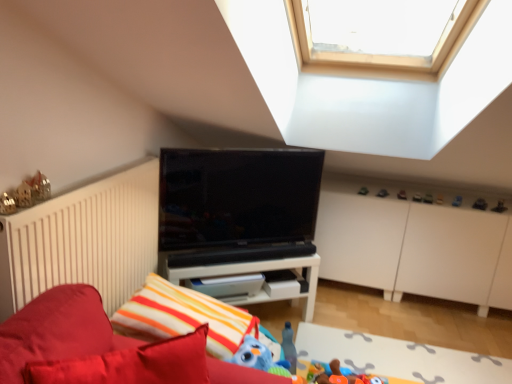
What do you see at coordinates (32, 191) in the screenshot? Image resolution: width=512 pixels, height=384 pixels. I see `wooden house at left, which is counted as the first toy, starting from the left` at bounding box center [32, 191].

Identify the location of green matte toy at upper right, the 1th toy from the back. (362, 191).

What do you see at coordinates (397, 357) in the screenshot? The image size is (512, 384). I see `white soft rug at lower center` at bounding box center [397, 357].

Measure the distance between white soft rug at lower center and camera.

They are 2.18 meters apart.

The width and height of the screenshot is (512, 384). What do you see at coordinates (237, 205) in the screenshot?
I see `black glossy tv at center` at bounding box center [237, 205].

Measure the distance between point (423, 201) and camera.

Point (423, 201) and camera are 9.32 feet apart from each other.

What are the coordinates of `wooden house at left, which is counted as the first toy, starting from the left` in the screenshot? It's located at (32, 191).

Which object is wider, matte black toy car at upper center, the sixth toy when ordered from left to right, or white soft rug at lower center?

With larger width is white soft rug at lower center.

Between matte black toy car at upper center, the sixth toy when ordered from left to right, and white soft rug at lower center, which one appears on the right side from the viewer's perspective?

matte black toy car at upper center, the sixth toy when ordered from left to right, is more to the right.

Is matte black toy car at upper center, acting as the 4th toy starting from the back, directly adjacent to white soft rug at lower center?

No, matte black toy car at upper center, acting as the 4th toy starting from the back, is not in contact with white soft rug at lower center.

From a real-world perspective, is matte black toy car at upper center, marked as the eighth toy in a front-to-back arrangement, above or below blue rubber duck at upper center, placed as the 7th toy when sorted from back to front?

From a real-world perspective, matte black toy car at upper center, marked as the eighth toy in a front-to-back arrangement, is physically below blue rubber duck at upper center, placed as the 7th toy when sorted from back to front.

From their relative heights in the image, would you say matte black toy car at upper center, marked as the eighth toy in a front-to-back arrangement, is taller or shorter than blue rubber duck at upper center, the 3th toy viewed from the right?

In the image, matte black toy car at upper center, marked as the eighth toy in a front-to-back arrangement, appears to be shorter than blue rubber duck at upper center, the 3th toy viewed from the right.

Which of these two, matte black toy car at upper center, the 6th toy from the right, or blue rubber duck at upper center, the 3th toy viewed from the right, is bigger?

With larger size is blue rubber duck at upper center, the 3th toy viewed from the right.

Is the depth of matte black toy car at upper center, marked as the eighth toy in a front-to-back arrangement, greater than that of blue rubber duck at upper center, the 3th toy viewed from the right?

Yes, matte black toy car at upper center, marked as the eighth toy in a front-to-back arrangement, is further from the viewer.

Find the location of a particular element. The image size is (512, 384). the 3rd toy below when counting from the smooth plastic toy at upper right, acting as the 7th toy starting from the left (from the image's perspective) is located at coordinates [x=480, y=204].

Is metallic black toy at upper right, which is the 8th toy from back to front, to the left or to the right of smooth plastic toy at upper right, which is the sixth toy in front-to-back order, in the image?

Based on their positions, metallic black toy at upper right, which is the 8th toy from back to front, is located to the right of smooth plastic toy at upper right, which is the sixth toy in front-to-back order.

Considering the sizes of objects metallic black toy at upper right, arranged as the 10th toy when viewed from the left, and smooth plastic toy at upper right, which ranks as the 5th toy in right-to-left order, in the image provided, who is taller, metallic black toy at upper right, arranged as the 10th toy when viewed from the left, or smooth plastic toy at upper right, which ranks as the 5th toy in right-to-left order,?

With more height is smooth plastic toy at upper right, which ranks as the 5th toy in right-to-left order.

Is wooden house at left, which is the eleventh toy in back-to-front order, oriented towards white matte dresser at center?

No.

At what (x,y) coordinates should I click in order to perform the action: click on dresser on the right of wooden house at left, which is counted as the first toy, starting from the left. Please return your answer as a coordinate pair (x, y). Image resolution: width=512 pixels, height=384 pixels. Looking at the image, I should click on (415, 248).

Is point (42, 189) closer to camera compared to point (445, 295)?

That is True.

Which object is further away from the camera, wooden house at left, which is counted as the first toy, starting from the left, or white matte dresser at center?

white matte dresser at center.

Would you say metallic black toy at upper right, acting as the second toy starting from the right, is part of matte black toy car at upper center, the sixth toy when ordered from left to right,'s contents?

No, metallic black toy at upper right, acting as the second toy starting from the right, is not a part of matte black toy car at upper center, the sixth toy when ordered from left to right.

Is matte black toy car at upper center, the 6th toy from the right, placed right next to metallic black toy at upper right, which is the 8th toy from back to front?

No, matte black toy car at upper center, the 6th toy from the right, is not with metallic black toy at upper right, which is the 8th toy from back to front.

Is matte black toy car at upper center, acting as the 4th toy starting from the back, oriented away from metallic black toy at upper right, acting as the second toy starting from the right?

matte black toy car at upper center, acting as the 4th toy starting from the back, does not have its back to metallic black toy at upper right, acting as the second toy starting from the right.

From the image's perspective, is matte black toy car at upper center, marked as the eighth toy in a front-to-back arrangement, under metallic black toy at upper right, acting as the second toy starting from the right?

No, from the image's perspective, matte black toy car at upper center, marked as the eighth toy in a front-to-back arrangement, is not beneath metallic black toy at upper right, acting as the second toy starting from the right.

Looking at their sizes, would you say green matte toy at upper right, the 11th toy in the front-to-back sequence, is wider or thinner than white matte shelf at center?

In the image, green matte toy at upper right, the 11th toy in the front-to-back sequence, appears to be more narrow than white matte shelf at center.

Is white matte shelf at center at the back of green matte toy at upper right, which appears as the ninth toy when viewed from the right?

No, green matte toy at upper right, which appears as the ninth toy when viewed from the right,'s orientation is not away from white matte shelf at center.

Which is in front, green matte toy at upper right, which appears as the ninth toy when viewed from the right, or white matte shelf at center?

white matte shelf at center.

Can you tell me how much velvet red bed at lower left and metallic silver toy at upper right, which is counted as the 1th toy, starting from the right, differ in facing direction?

The angular difference between velvet red bed at lower left and metallic silver toy at upper right, which is counted as the 1th toy, starting from the right, is 79.1 degrees.

Is velvet red bed at lower left closer to camera compared to metallic silver toy at upper right, which ranks as the eleventh toy in left-to-right order?

That is True.

Could you tell me if velvet red bed at lower left is turned towards metallic silver toy at upper right, which appears as the third toy when viewed from the front?

No, velvet red bed at lower left is not turned towards metallic silver toy at upper right, which appears as the third toy when viewed from the front.

From the image's perspective, count 7th toys upward from the white soft rug at lower center and point to it. Please provide its 2D coordinates.

[(417, 197)]

From a real-world perspective, count 6th toys downward from the blue rubber duck at upper center, placed as the 7th toy when sorted from back to front, and point to it. Please provide its 2D coordinates.

[(417, 197)]

From the image, which object appears to be nearer to matte black toy car at upper center, the sixth toy when ordered from left to right, white matte shelf at center or black glossy tv at center?

The object closer to matte black toy car at upper center, the sixth toy when ordered from left to right, is white matte shelf at center.

When comparing their distances from matte black toy car at upper center, the 3th toy when ordered from back to front, does velvet red bed at lower left or smooth plastic toy at center, positioned as the seventh toy in front-to-back order, seem closer?

smooth plastic toy at center, positioned as the seventh toy in front-to-back order, is closer to matte black toy car at upper center, the 3th toy when ordered from back to front.

In the scene shown: From the image, which object appears to be farther from green matte toy at upper right, the 1th toy from the back, matte black toy car at upper right, the fourth toy when ordered from left to right, or metallic black toy at upper right, the 4th toy viewed from the front?

The object further to green matte toy at upper right, the 1th toy from the back, is metallic black toy at upper right, the 4th toy viewed from the front.

When comparing their distances from matte black toy car at upper center, the 5th toy viewed from the left, does smooth plastic toy at center, positioned as the seventh toy in front-to-back order, or white matte shelf at center seem closer?

Based on the image, smooth plastic toy at center, positioned as the seventh toy in front-to-back order, appears to be nearer to matte black toy car at upper center, the 5th toy viewed from the left.

Based on their spatial positions, is white matte dresser at center or metallic silver toy at upper right, which appears as the third toy when viewed from the front, closer to black glossy tv at center?

Based on the image, white matte dresser at center appears to be nearer to black glossy tv at center.

Considering their positions, is wooden house at left, which is the eleventh toy in back-to-front order, positioned further to white matte shelf at center than black glossy tv at center?

wooden house at left, which is the eleventh toy in back-to-front order.

Looking at the image, which one is located further to blue rubber duck at upper center, the fifth toy from the front, smooth plastic toy at upper right, which ranks as the 6th toy in back-to-front order, or matte black toy car at upper center, marked as the eighth toy in a front-to-back arrangement?

Based on the image, matte black toy car at upper center, marked as the eighth toy in a front-to-back arrangement, appears to be further to blue rubber duck at upper center, the fifth toy from the front.

Estimate the real-world distances between objects in this image. Which object is closer to smooth plastic toy at center, which ranks as the fifth toy in back-to-front order, black glossy tv at center or white soft rug at lower center?

The object closer to smooth plastic toy at center, which ranks as the fifth toy in back-to-front order, is white soft rug at lower center.

Where is `furniture between wooden house at left, which appears as the eleventh toy when viewed from the right, and blue rubber duck at upper center, the fifth toy from the front, in the horizontal direction`? This screenshot has height=384, width=512. furniture between wooden house at left, which appears as the eleventh toy when viewed from the right, and blue rubber duck at upper center, the fifth toy from the front, in the horizontal direction is located at coordinates (58, 330).

Where is `dresser located between soft plush toy at lower center, acting as the second toy starting from the front, and smooth plastic toy at upper right, which is the sixth toy in front-to-back order, in the depth direction`? dresser located between soft plush toy at lower center, acting as the second toy starting from the front, and smooth plastic toy at upper right, which is the sixth toy in front-to-back order, in the depth direction is located at coordinates pos(415,248).

Locate an element on the screen. This screenshot has width=512, height=384. dresser situated between matte black toy car at upper right, acting as the second toy starting from the back, and metallic black toy at upper right, which is the 8th toy from back to front, from left to right is located at coordinates (415, 248).

The height and width of the screenshot is (384, 512). Identify the location of dresser located between soft plush toy at lower center, which is counted as the 2th toy, starting from the left, and matte black toy car at upper right, the tenth toy from the front, in the depth direction. (415, 248).